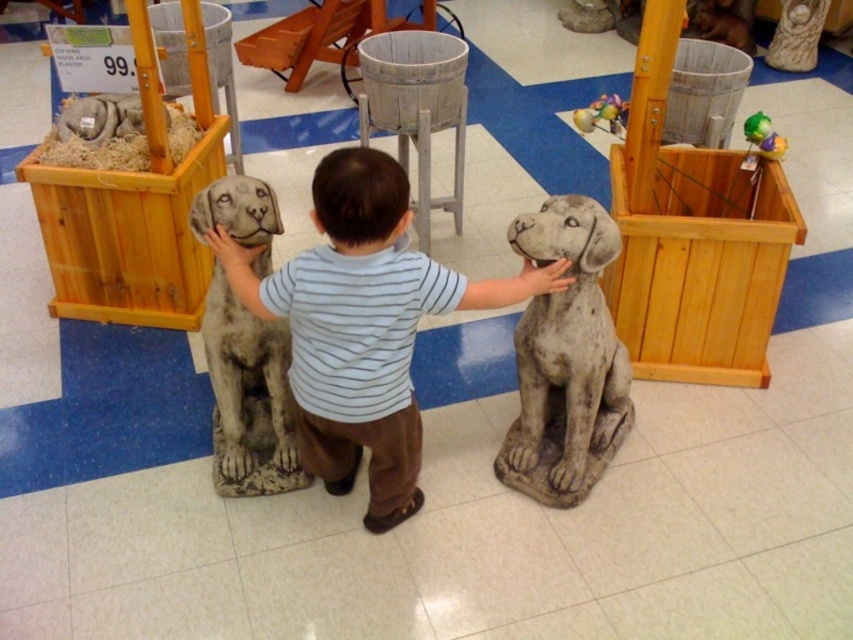
In the scene shown: You are a customer in the store and want to pick up the shiny plastic ball at upper right. Is the wooden crate at right blocking your path to it?

The wooden crate at right is in front of the shiny plastic ball at upper right, so it is blocking the path to the ball.

You are a customer in the store and want to place a small decorative item between the two points. Which point is closer to you, point (688, 252) or point (230, 308)?

Point (688, 252) is closer to you than point (230, 308) because it is further to the viewer.

You are a customer in a store and want to place a new decorative item between the wooden crate at right and the shiny plastic ball at upper right. Based on their positions, which side should you place it on to keep it centered between them?

Since the wooden crate at right is to the left of the shiny plastic ball at upper right, placing the new item to the right of the wooden crate at right and to the left of the shiny plastic ball at upper right would center it between them.